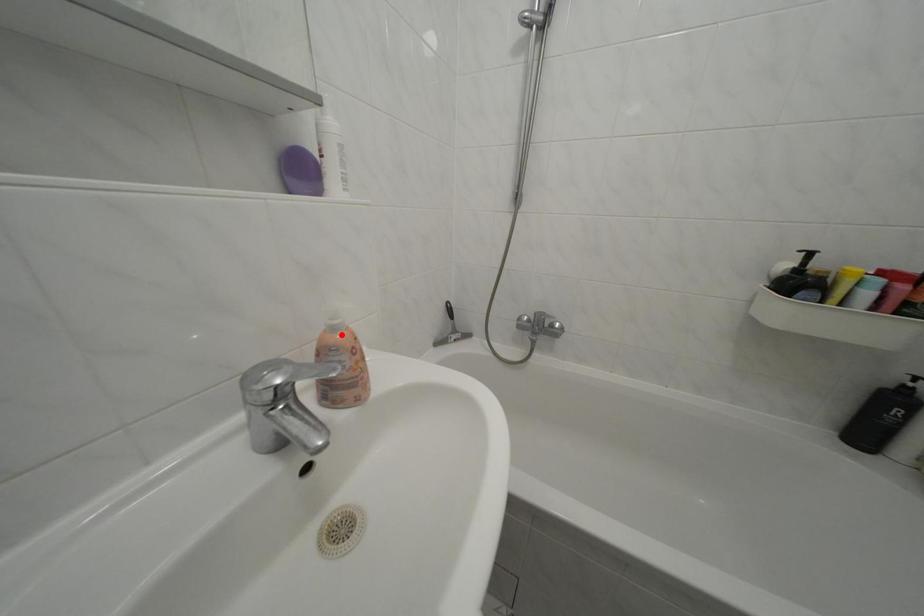
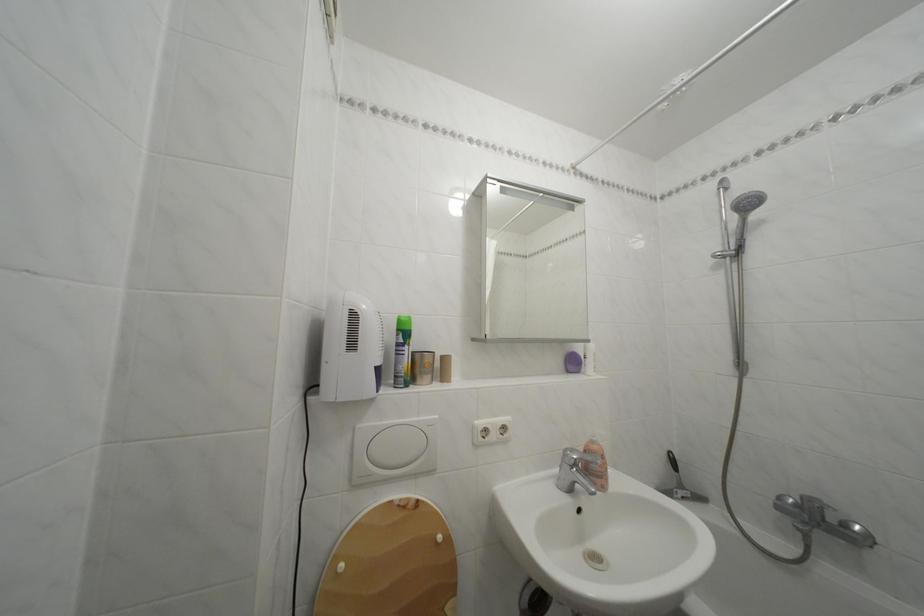
Where in the second image is the point corresponding to the highlighted location from the first image?

(602, 448)